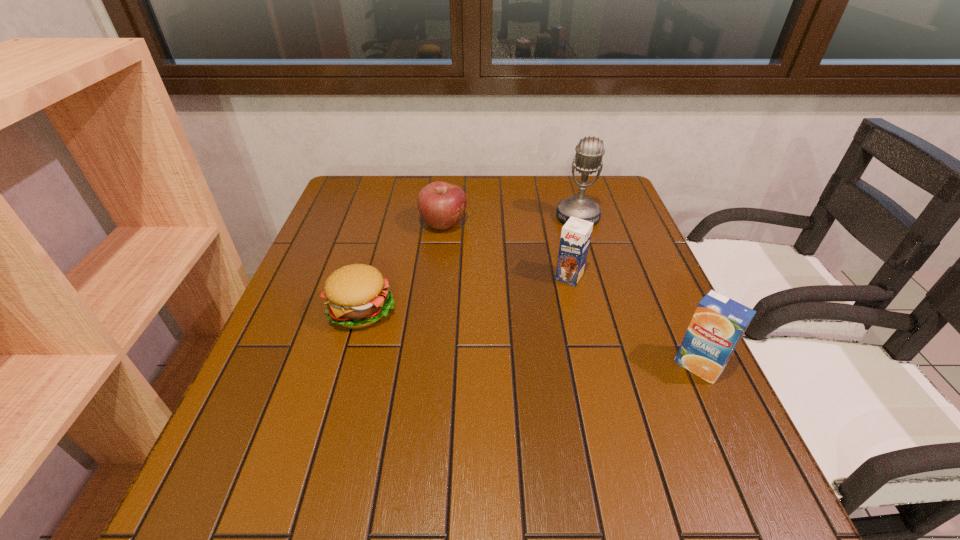
The height and width of the screenshot is (540, 960). I want to click on free space on the desktop that is between the leftmost object and the nearest object and is positioned on the front-facing side of the tallest object, so click(x=560, y=342).

Identify the location of free spot on the desktop that is between the leftmost object and the rightmost object and is positioned on the side of the apple with the unique marking. The image size is (960, 540). (564, 343).

The width and height of the screenshot is (960, 540). In order to click on vacant space on the desktop that is between the leftmost object and the orange_juice and is positioned on the front label of the chocolate milk in this screenshot , I will do click(x=529, y=338).